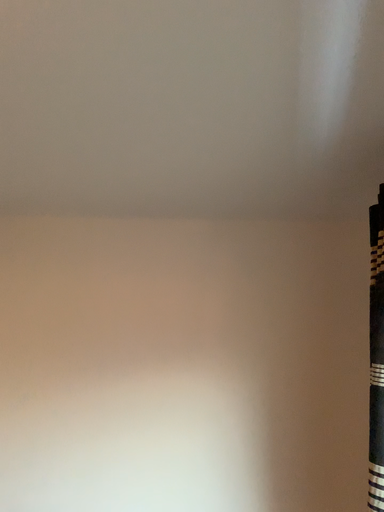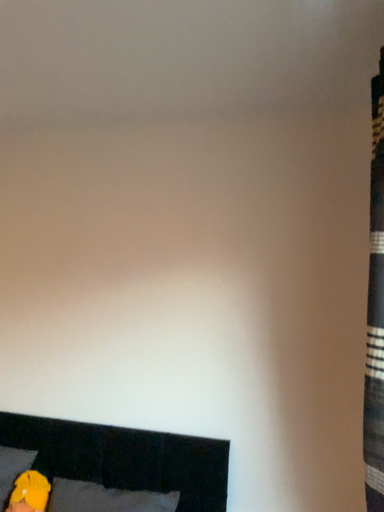
Question: How did the camera likely rotate when shooting the video?

Choices:
 (A) rotated downward
 (B) rotated upward

Answer: (A)